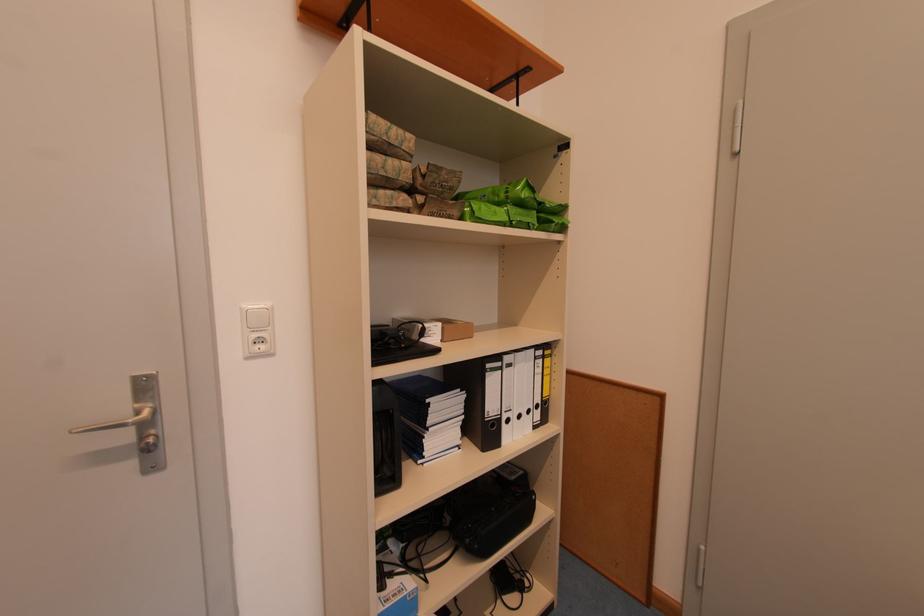
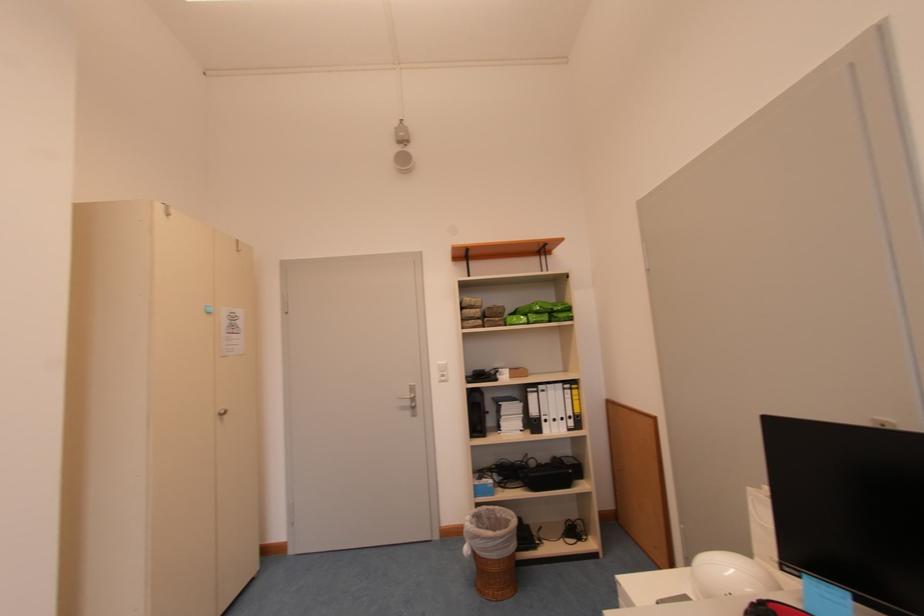
Find the pixel in the second image that matches point (495, 368) in the first image.

(536, 392)